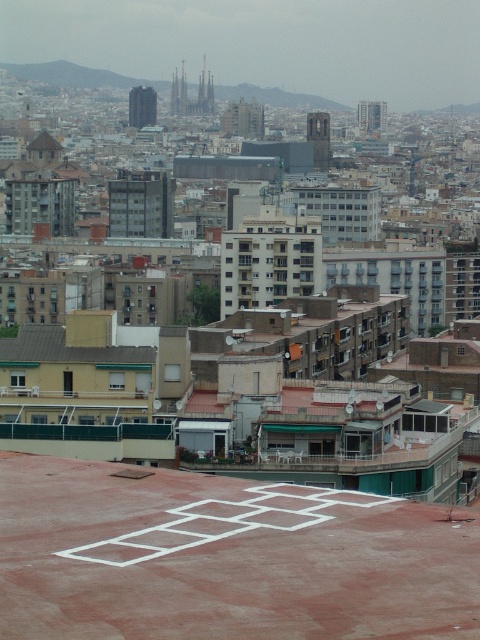
You are a city planner analyzing rooftop spaces. You observe the red concrete hopscotch at center and the brown corrugated metal roof at center. Which of these two occupies a smaller area on the rooftop?

The red concrete hopscotch at center occupies less space than the brown corrugated metal roof at center, so the red concrete hopscotch at center is the smaller one.

You are a painter who needs to decide which surface to paint first. The red concrete hopscotch at center and the brown corrugated metal roof at center are both in your view. Which surface is narrower in width?

The red concrete hopscotch at center is thinner than the brown corrugated metal roof at center, so the red concrete hopscotch at center is narrower in width.

You are standing on the rooftop and want to take a photo of both the red concrete hopscotch at center and the brown corrugated metal roof at center. Which object should you focus on first to ensure both are in clear view?

You should focus on the red concrete hopscotch at center first because it is closer to you than the brown corrugated metal roof at center, ensuring both are in clear view when focused properly.